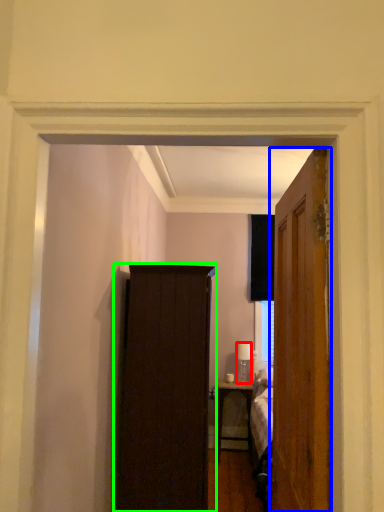
Question: Based on their relative distances, which object is nearer to lamp (highlighted by a red box)? Choose from door (highlighted by a blue box) and cabinetry (highlighted by a green box).

Choices:
 (A) door
 (B) cabinetry

Answer: (B)